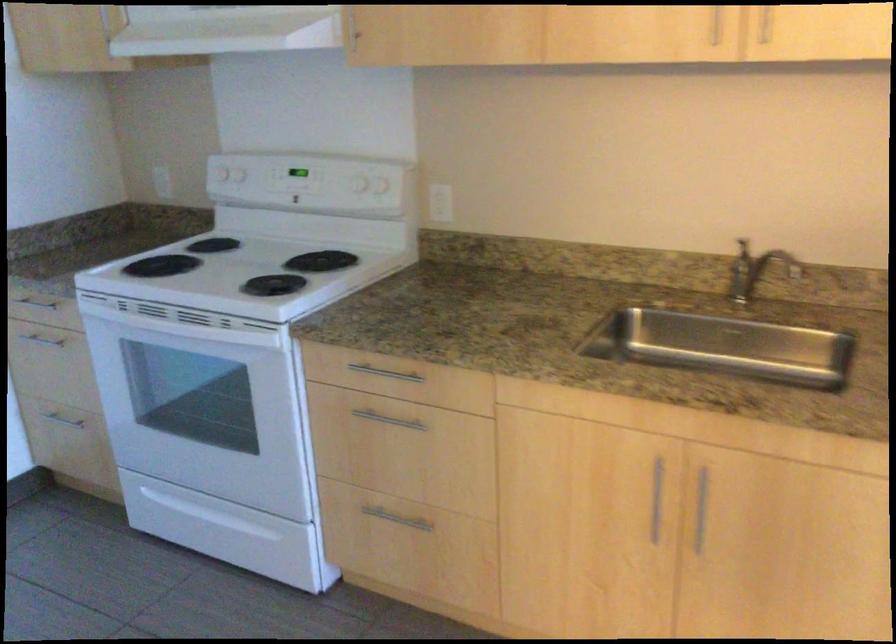
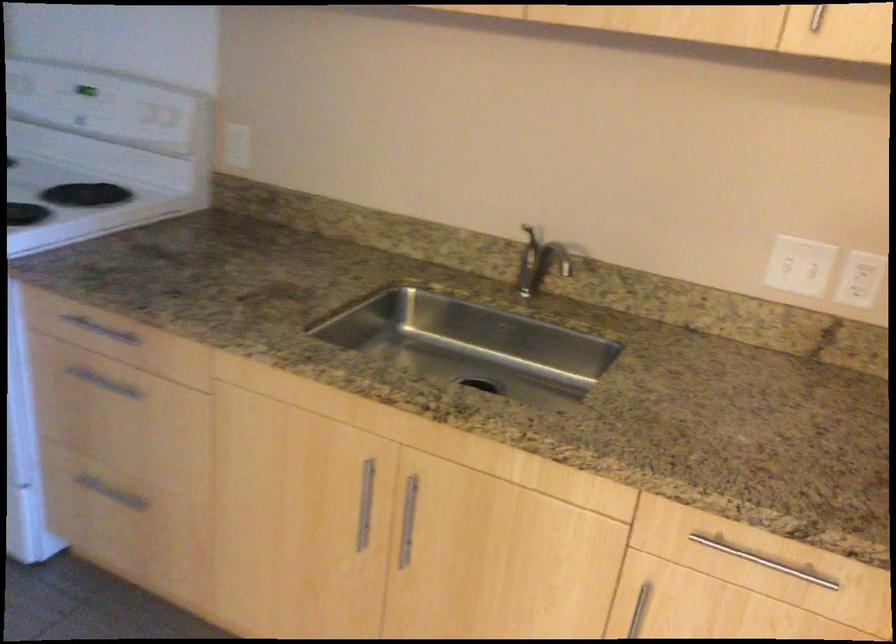
Locate, in the second image, the point that corresponds to [702,507] in the first image.

(408, 520)